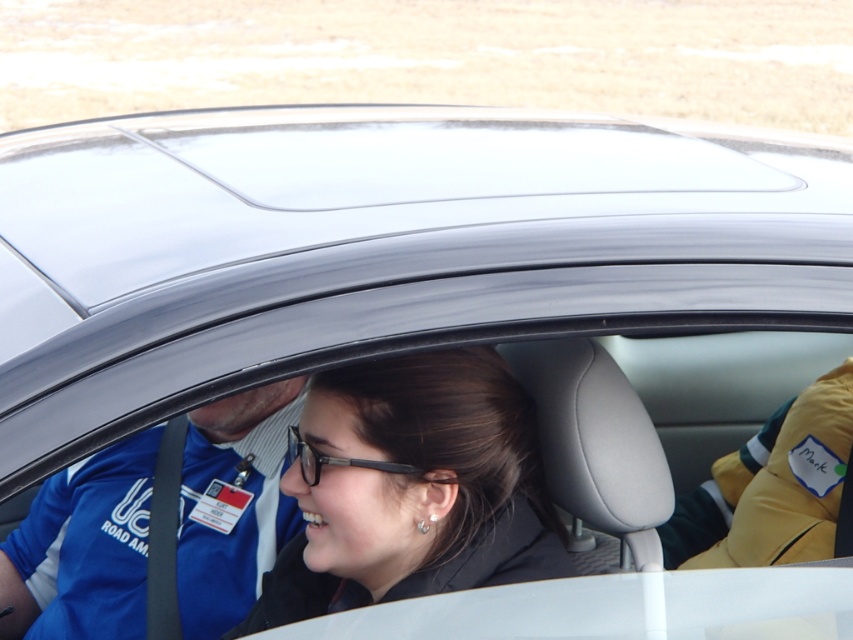
Question: Is matte black hair at center wider than blue fabric shirt at left?

Choices:
 (A) yes
 (B) no

Answer: (B)

Question: Which point is farther from the camera taking this photo?

Choices:
 (A) (252, 563)
 (B) (444, 372)
 (C) (302, 440)

Answer: (A)

Question: Estimate the real-world distances between objects in this image. Which object is farther from the black plastic glasses at center?

Choices:
 (A) matte black hair at center
 (B) blue fabric shirt at left

Answer: (B)

Question: From the image, what is the correct spatial relationship of matte black hair at center in relation to blue fabric shirt at left?

Choices:
 (A) below
 (B) above

Answer: (B)

Question: Can you confirm if matte black hair at center is positioned to the right of blue fabric shirt at left?

Choices:
 (A) no
 (B) yes

Answer: (B)

Question: Which of these objects is positioned farthest from the matte black hair at center?

Choices:
 (A) blue fabric shirt at left
 (B) black plastic glasses at center

Answer: (A)